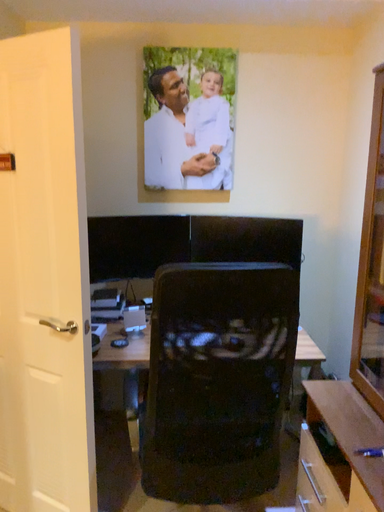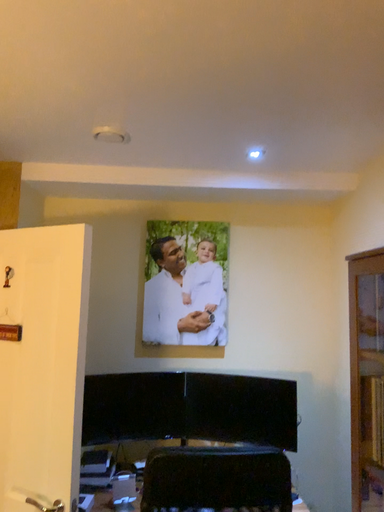
Question: How did the camera likely rotate when shooting the video?

Choices:
 (A) rotated upward
 (B) rotated downward

Answer: (A)